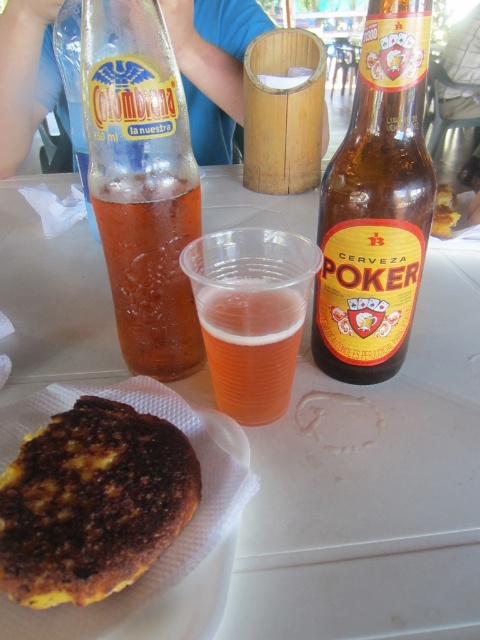
Question: Is golden-brown crispy bread at lower left to the left of brown crispy bread at center from the viewer's perspective?

Choices:
 (A) yes
 (B) no

Answer: (A)

Question: Can you confirm if white plastic table at center is bigger than brown crispy bread at center?

Choices:
 (A) yes
 (B) no

Answer: (A)

Question: Which of the following is the closest to the observer?

Choices:
 (A) (327, 243)
 (B) (453, 227)
 (C) (120, 582)
 (D) (162, 180)

Answer: (C)

Question: Which of the following is the closest to the observer?

Choices:
 (A) brown glass bottle at upper center
 (B) white plastic table at center
 (C) brown crispy bread at center

Answer: (B)

Question: Is white plastic table at center to the right of brown crispy bread at center from the viewer's perspective?

Choices:
 (A) no
 (B) yes

Answer: (A)

Question: Which point is closer to the camera taking this photo?

Choices:
 (A) (264, 323)
 (B) (442, 188)
 (C) (179, 496)
 (D) (389, 616)

Answer: (D)